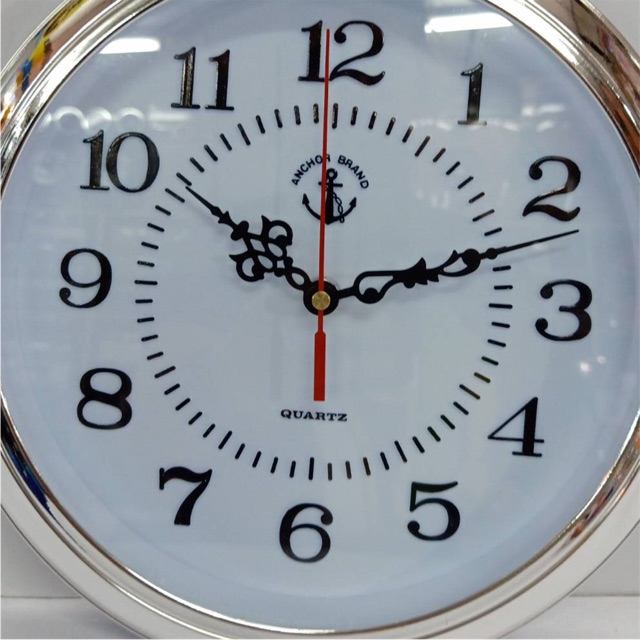
Identify the location of round gold piece in center of clock. (319, 300).